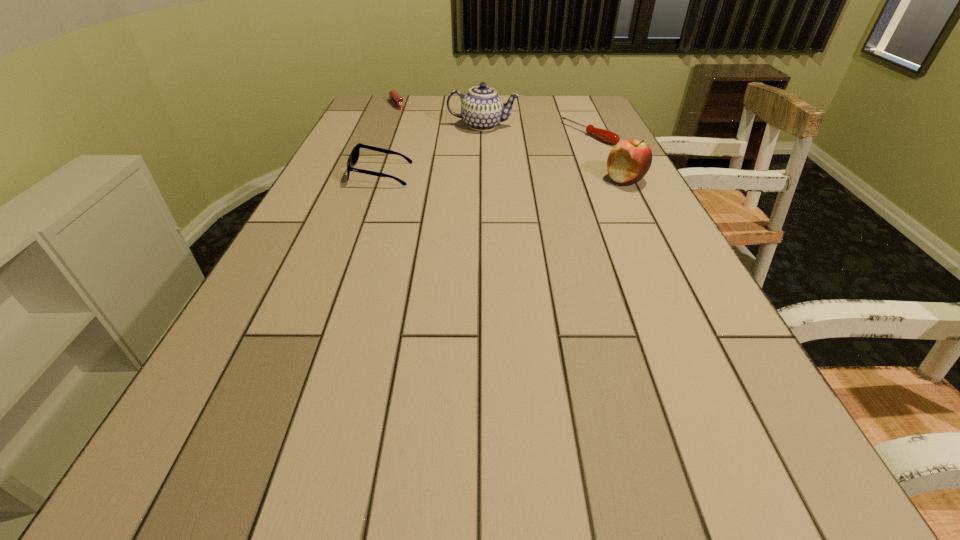
Identify the location of vacant spot on the desktop that is between the sunglasses and the fourth shortest object and is positioned at the tip of the shortest object. (477, 177).

Locate an element on the screen. free space on the desktop that is between the sunglasses and the second tallest object and is positioned at the spout of the chinaware is located at coordinates [x=467, y=176].

Where is `free space on the desktop that is between the third shortest object and the second tallest object and is positioned on the front-facing side of the stapler`? free space on the desktop that is between the third shortest object and the second tallest object and is positioned on the front-facing side of the stapler is located at coordinates (466, 176).